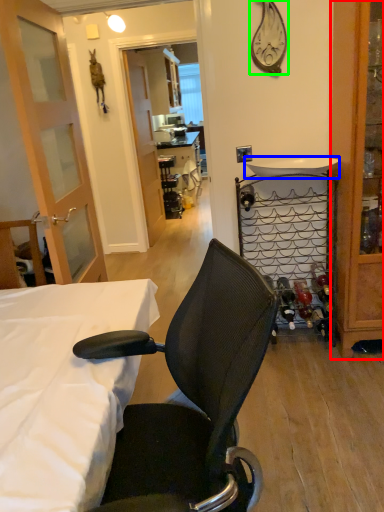
Question: Which object is the closest to the cabinetry (highlighted by a red box)? Choose among these: sink (highlighted by a blue box) or clock (highlighted by a green box).

Choices:
 (A) sink
 (B) clock

Answer: (A)